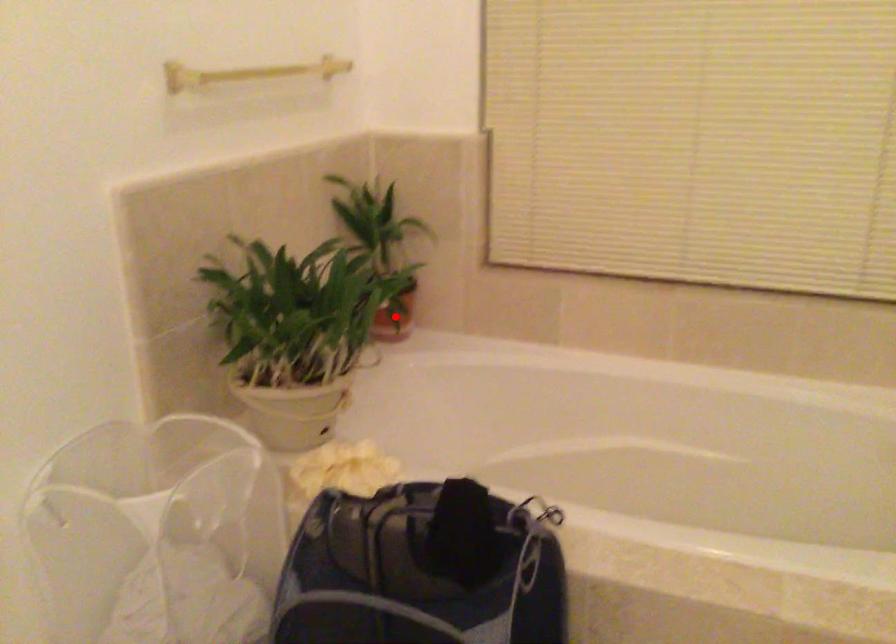
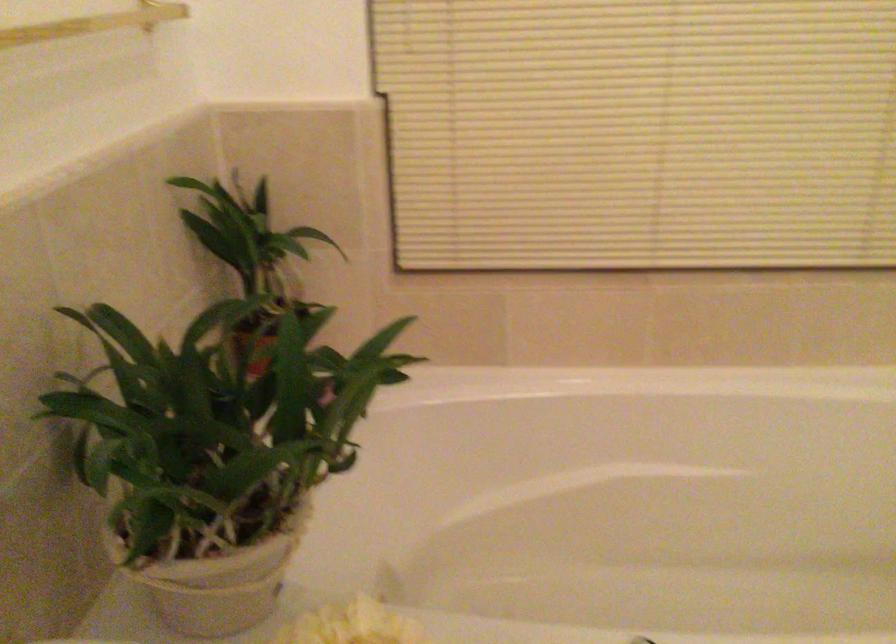
Question: I am providing you with two images of the same scene from different viewpoints. A red point is marked on the first image. At the location where the point appears in image 1, is it still visible in image 2?

Choices:
 (A) Yes
 (B) No

Answer: (B)